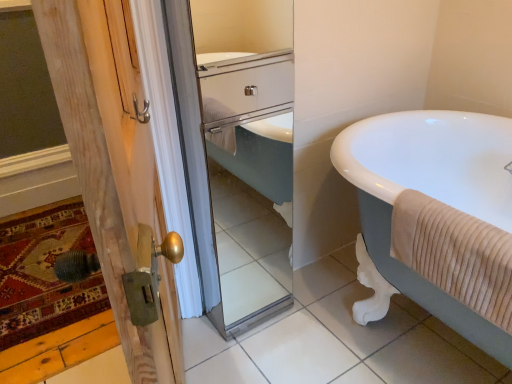
Question: From a real-world perspective, is beige ribbed towel at right physically located above or below wooden door at left?

Choices:
 (A) above
 (B) below

Answer: (A)

Question: From the image's perspective, is beige ribbed towel at right located above or below wooden door at left?

Choices:
 (A) above
 (B) below

Answer: (B)

Question: Which object is the closest to the clear glass mirror at center?

Choices:
 (A) white glossy bathtub at right
 (B) wooden door at left
 (C) beige ribbed towel at right

Answer: (B)

Question: Which object is positioned farthest from the wooden door at left?

Choices:
 (A) clear glass mirror at center
 (B) beige ribbed towel at right
 (C) white glossy bathtub at right

Answer: (C)